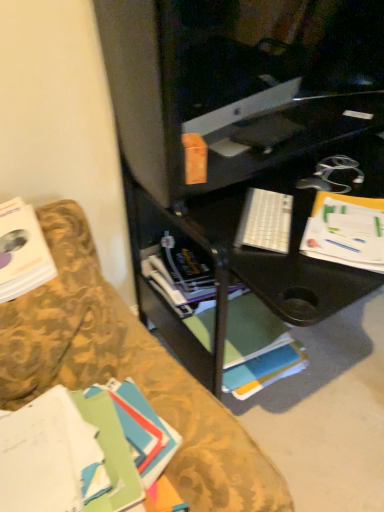
Find the location of a particular element. This screenshot has width=384, height=512. vacant area situated below white paper at right (from a real-world perspective) is located at coordinates (319, 393).